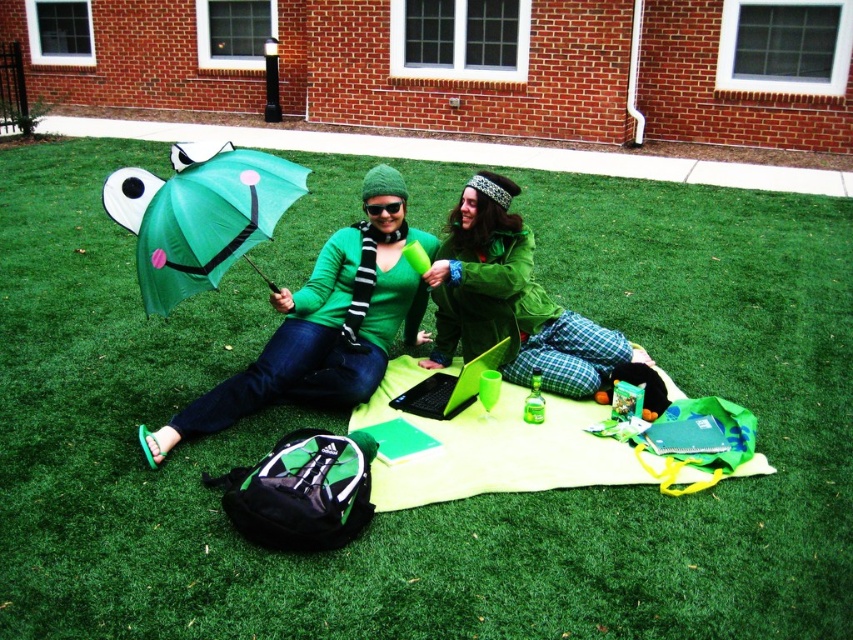
Does green fuzzy jacket at center have a smaller size compared to matte green umbrella at center?

No, green fuzzy jacket at center is not smaller than matte green umbrella at center.

Is green fuzzy jacket at center thinner than matte green umbrella at center?

No.

Measure the distance between point (570, 332) and camera.

They are 13.33 feet apart.

Identify the location of green fuzzy jacket at center. (509, 300).

Describe the element at coordinates (325, 324) in the screenshot. I see `matte green umbrella at upper left` at that location.

Between matte green umbrella at upper left and green fuzzy jacket at center, which one is positioned lower?

matte green umbrella at upper left

What are the coordinates of `matte green umbrella at upper left` in the screenshot? It's located at (325, 324).

Between matte green umbrella at upper left and matte green umbrella at center, which one appears on the left side from the viewer's perspective?

From the viewer's perspective, matte green umbrella at center appears more on the left side.

Is matte green umbrella at upper left to the right of matte green umbrella at center from the viewer's perspective?

Correct, you'll find matte green umbrella at upper left to the right of matte green umbrella at center.

Between point (320, 344) and point (271, 177), which one is positioned behind?

The point (320, 344) is behind.

This screenshot has width=853, height=640. Identify the location of matte green umbrella at upper left. (325, 324).